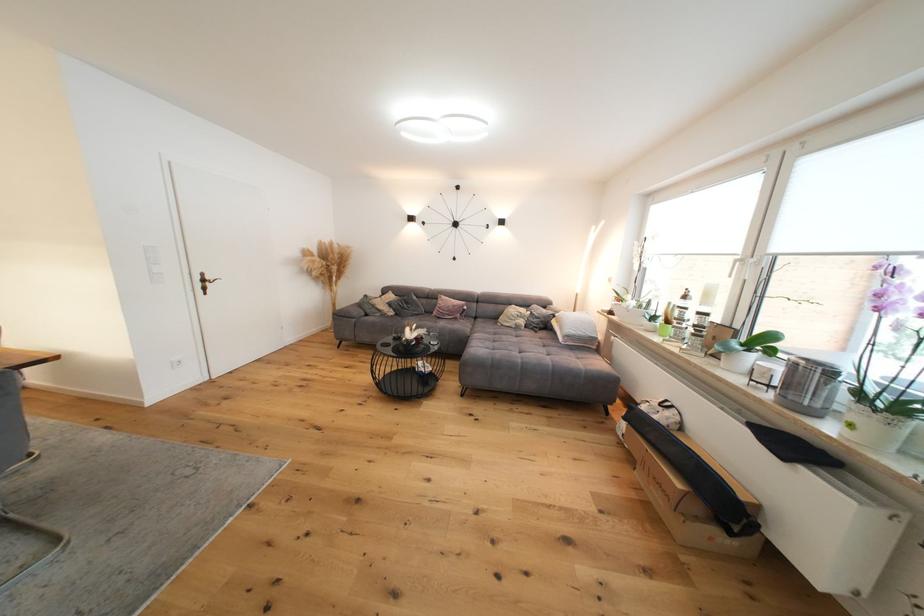
Describe the element at coordinates (448, 308) in the screenshot. I see `a pink velvet pillow` at that location.